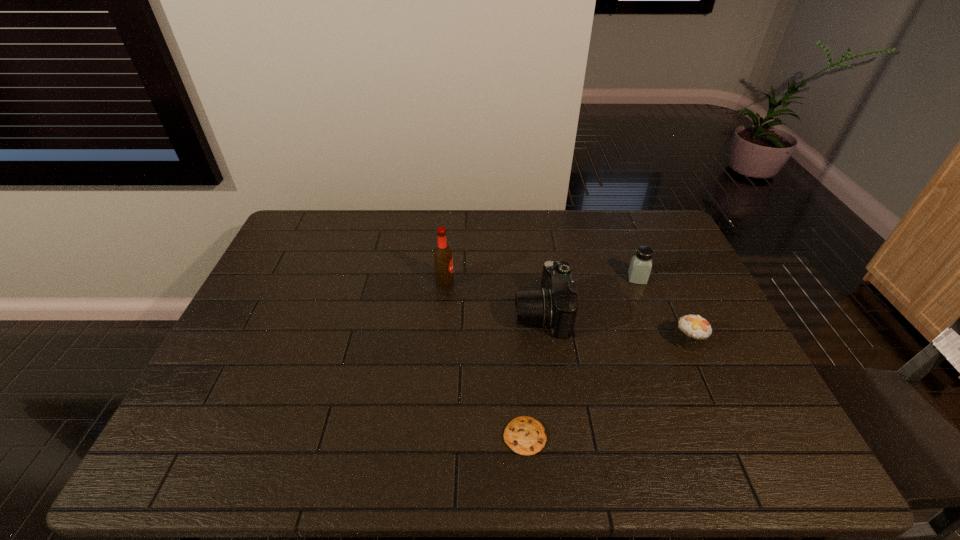
The width and height of the screenshot is (960, 540). Identify the location of free point located 0.330m on the lens of the camera. (402, 314).

The width and height of the screenshot is (960, 540). What are the coordinates of `vacant space located 0.140m on the front of the third tallest object` in the screenshot? It's located at (653, 318).

I want to click on vacant space located 0.270m on the front of the fourth tallest object, so click(736, 449).

In order to click on vacant space located 0.330m on the left of the cookie in this screenshot , I will do `click(359, 436)`.

Locate an element on the screen. This screenshot has height=540, width=960. object that is positioned at the near edge is located at coordinates (525, 435).

Where is `saltshaker positioned at the right edge`? Image resolution: width=960 pixels, height=540 pixels. saltshaker positioned at the right edge is located at coordinates (639, 271).

What are the coordinates of `cupcake at the right edge` in the screenshot? It's located at (692, 332).

The height and width of the screenshot is (540, 960). In the image, there is a desktop. Identify the location of vacant space at the far edge. tap(342, 245).

This screenshot has height=540, width=960. Identify the location of vacant space at the near edge of the desktop. (451, 447).

Where is `blank area at the left edge`? The width and height of the screenshot is (960, 540). blank area at the left edge is located at coordinates (300, 295).